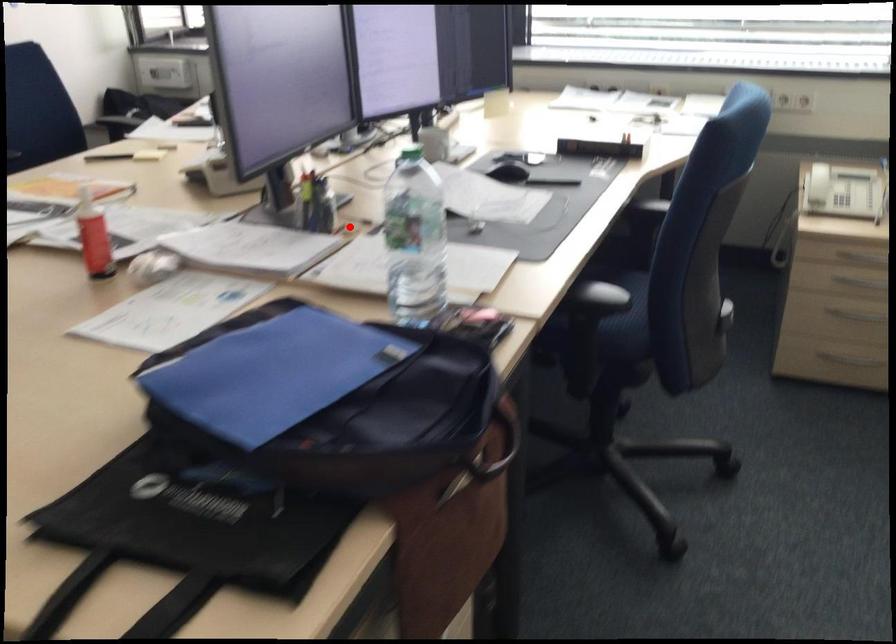
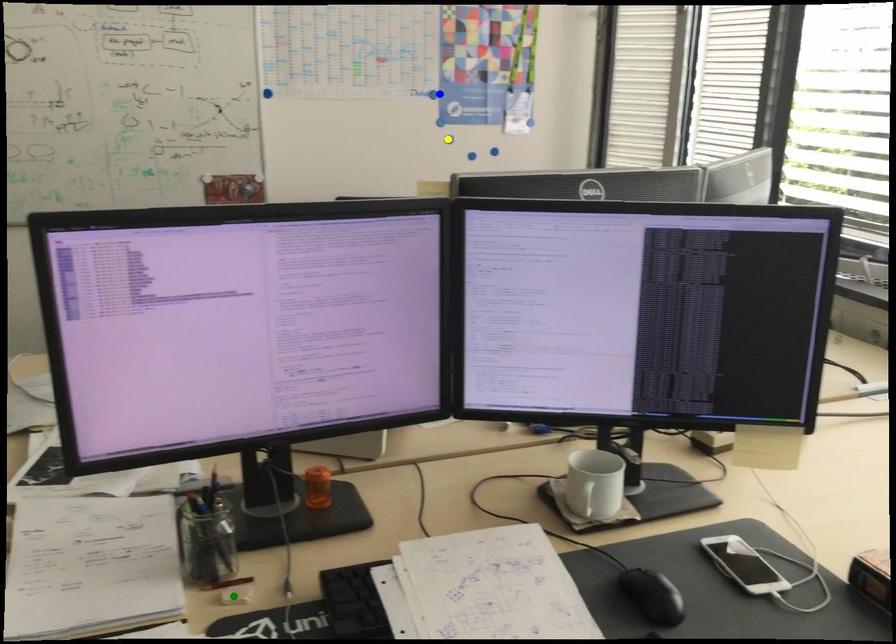
Question: I am providing you with two images of the same scene from different viewpoints. A red point is marked on the first image. You are given multiple points on the second image. Which point in image 2 represents the same 3d spot as the red point in image 1?

Choices:
 (A) blue point
 (B) yellow point
 (C) green point

Answer: (C)